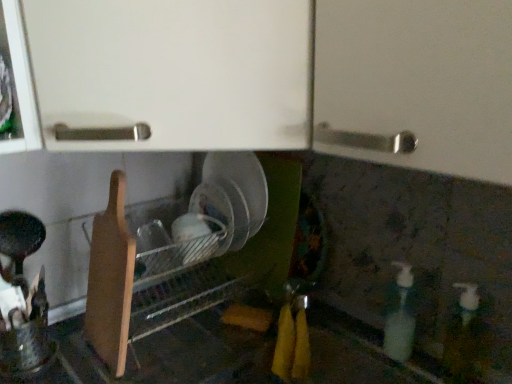
Question: From a real-world perspective, is wooden cutting board at lower left below translucent plastic soap dispenser at lower right, the 2th bottle when ordered from right to left?

Choices:
 (A) yes
 (B) no

Answer: (B)

Question: Is wooden cutting board at lower left positioned with its back to translucent plastic soap dispenser at lower right, the 2th bottle when ordered from right to left?

Choices:
 (A) no
 (B) yes

Answer: (A)

Question: Is translucent plastic soap dispenser at lower right, which is the first bottle from left to right, completely or partially inside wooden cutting board at lower left?

Choices:
 (A) yes
 (B) no

Answer: (B)

Question: Can you confirm if wooden cutting board at lower left is thinner than translucent plastic soap dispenser at lower right, which is the first bottle from left to right?

Choices:
 (A) yes
 (B) no

Answer: (B)

Question: Considering the relative sizes of wooden cutting board at lower left and translucent plastic soap dispenser at lower right, which is the first bottle from left to right, in the image provided, is wooden cutting board at lower left shorter than translucent plastic soap dispenser at lower right, which is the first bottle from left to right,?

Choices:
 (A) no
 (B) yes

Answer: (A)

Question: Considering the relative positions of wooden cutting board at lower left and translucent plastic soap dispenser at lower right, the 2th bottle when ordered from right to left, in the image provided, is wooden cutting board at lower left to the right of translucent plastic soap dispenser at lower right, the 2th bottle when ordered from right to left, from the viewer's perspective?

Choices:
 (A) yes
 (B) no

Answer: (B)

Question: Is white glossy bottle at lower right, which is the second bottle from left to right, aimed at translucent plastic soap dispenser at lower right, the 2th bottle when ordered from right to left?

Choices:
 (A) yes
 (B) no

Answer: (B)

Question: Is white glossy bottle at lower right, the first bottle positioned from the right, looking in the opposite direction of translucent plastic soap dispenser at lower right, which is the first bottle from left to right?

Choices:
 (A) no
 (B) yes

Answer: (A)

Question: Considering the relative sizes of white glossy bottle at lower right, the first bottle positioned from the right, and translucent plastic soap dispenser at lower right, the 2th bottle when ordered from right to left, in the image provided, is white glossy bottle at lower right, the first bottle positioned from the right, taller than translucent plastic soap dispenser at lower right, the 2th bottle when ordered from right to left,?

Choices:
 (A) no
 (B) yes

Answer: (A)

Question: Is white glossy bottle at lower right, which is the second bottle from left to right, shorter than translucent plastic soap dispenser at lower right, which is the first bottle from left to right?

Choices:
 (A) no
 (B) yes

Answer: (B)

Question: Is white glossy bottle at lower right, the first bottle positioned from the right, bigger than translucent plastic soap dispenser at lower right, which is the first bottle from left to right?

Choices:
 (A) yes
 (B) no

Answer: (A)

Question: Considering the relative positions of white glossy bottle at lower right, the first bottle positioned from the right, and translucent plastic soap dispenser at lower right, the 2th bottle when ordered from right to left, in the image provided, is white glossy bottle at lower right, the first bottle positioned from the right, to the left of translucent plastic soap dispenser at lower right, the 2th bottle when ordered from right to left, from the viewer's perspective?

Choices:
 (A) no
 (B) yes

Answer: (A)

Question: Does white glossy bottle at lower right, the first bottle positioned from the right, contain wooden cutting board at lower left?

Choices:
 (A) no
 (B) yes

Answer: (A)